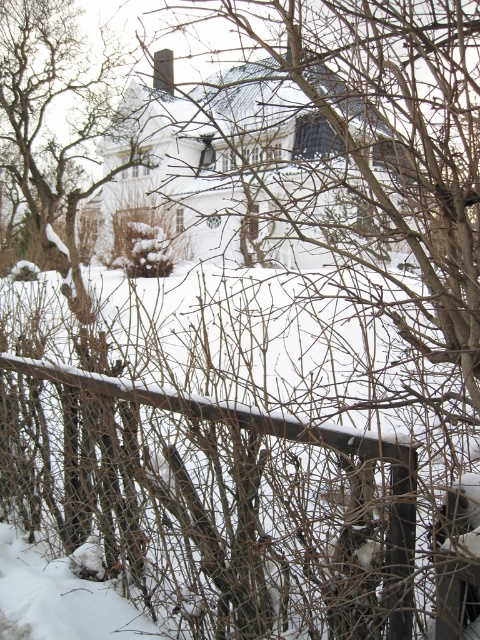
Question: Is brown textured tree at upper left below metal fence at center?

Choices:
 (A) no
 (B) yes

Answer: (A)

Question: Which object is farther from the camera taking this photo?

Choices:
 (A) metal fence at center
 (B) brown textured tree at upper left

Answer: (B)

Question: Is the position of brown textured tree at upper left less distant than that of metal fence at center?

Choices:
 (A) yes
 (B) no

Answer: (B)

Question: Is brown textured tree at upper left above metal fence at center?

Choices:
 (A) yes
 (B) no

Answer: (A)

Question: Among these objects, which one is farthest from the camera?

Choices:
 (A) brown textured tree at upper left
 (B) metal fence at center

Answer: (A)